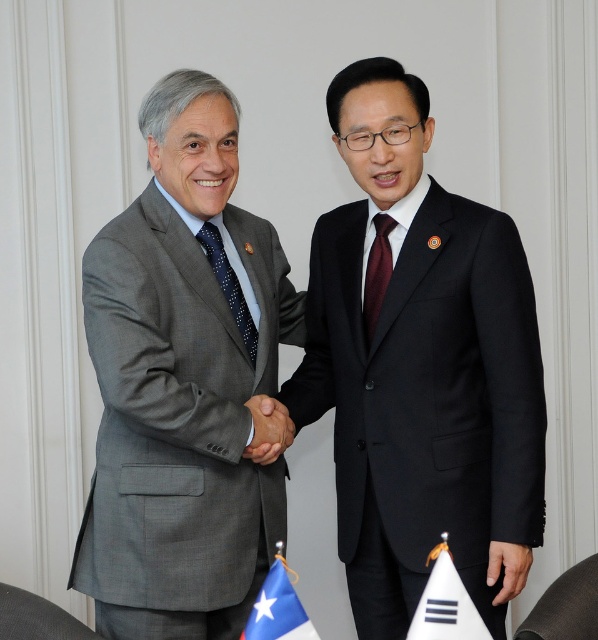
Question: Which point appears farthest from the camera in this image?

Choices:
 (A) 254,621
 (B) 133,273

Answer: (B)

Question: Can you confirm if blue fabric flag at lower left is thinner than matte gray suit at center?

Choices:
 (A) no
 (B) yes

Answer: (B)

Question: Which point is closer to the camera taking this photo?

Choices:
 (A) (453, 608)
 (B) (199, 499)

Answer: (A)

Question: Can you confirm if white fabric flag at lower center is smaller than burgundy silk tie at center?

Choices:
 (A) no
 (B) yes

Answer: (A)

Question: Can you confirm if white fabric flag at lower center is smaller than blue fabric flag at lower left?

Choices:
 (A) yes
 (B) no

Answer: (B)

Question: Which point is farther from the camera taking this photo?

Choices:
 (A) (309, 400)
 (B) (504, 554)

Answer: (A)